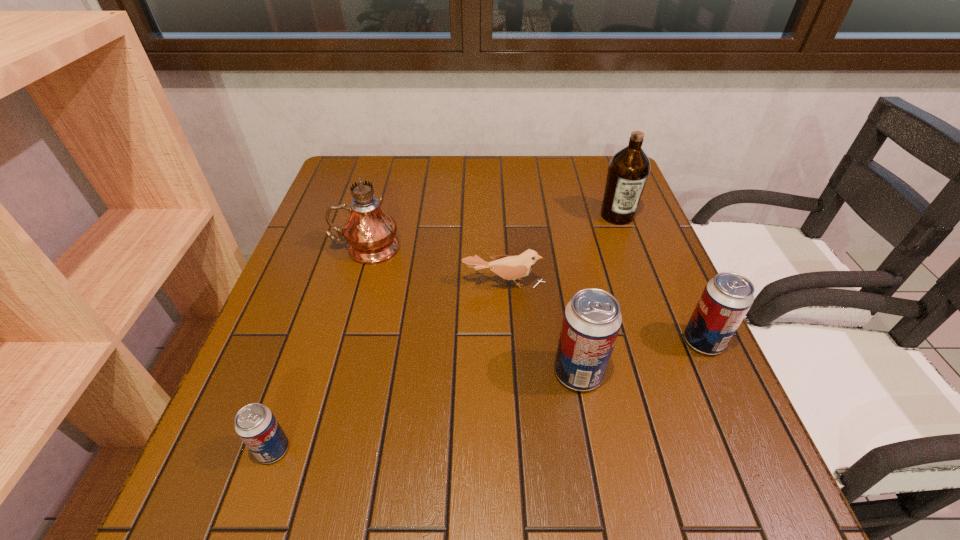
The image size is (960, 540). In order to click on vacant space located on the back of the shortest beer can in this screenshot , I will do `click(294, 388)`.

Locate an element on the screen. free space located on the back of the second beer can from left to right is located at coordinates (x=556, y=254).

Identify the location of vacant space located 0.140m on the left of the rightmost beer can. Image resolution: width=960 pixels, height=540 pixels. (615, 341).

Where is `free location located on the front of the tallest object`? The width and height of the screenshot is (960, 540). free location located on the front of the tallest object is located at coordinates (329, 378).

The width and height of the screenshot is (960, 540). Identify the location of free space located on the label of the fifth shortest object. (646, 291).

Find the location of a particular element. This screenshot has width=960, height=540. vacant space located at the beak of the bird is located at coordinates (506, 319).

Locate an element on the screen. This screenshot has width=960, height=540. object present at the near edge is located at coordinates (255, 424).

This screenshot has height=540, width=960. I want to click on beer can that is at the left edge, so click(x=255, y=424).

This screenshot has height=540, width=960. In order to click on oil lamp at the left edge in this screenshot , I will do pos(370,232).

In order to click on beer can that is at the right edge in this screenshot , I will do `click(726, 299)`.